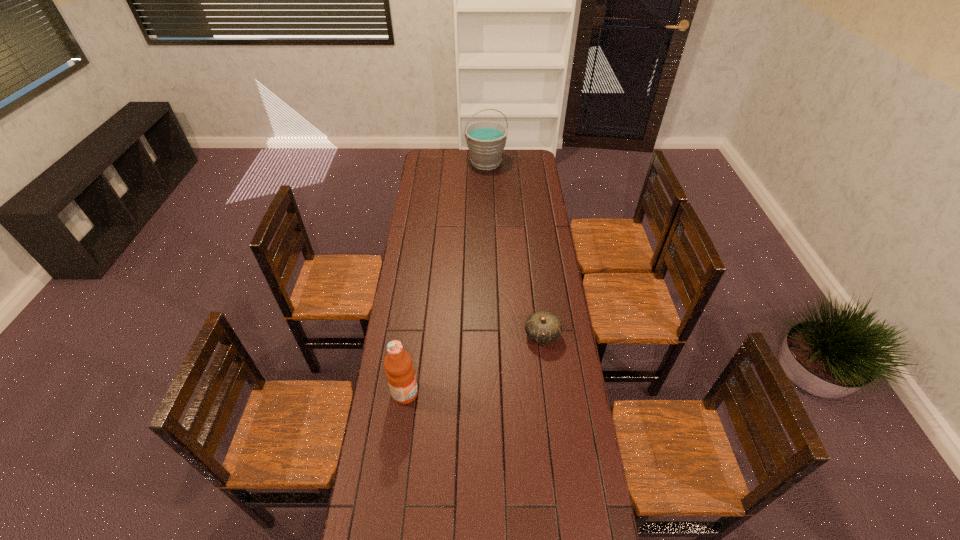
Find the location of `object located at the left edge`. object located at the left edge is located at coordinates (400, 373).

Locate an element on the screen. This screenshot has height=540, width=960. object that is at the right edge is located at coordinates (541, 327).

Find the location of a particular element. vacant area at the left edge is located at coordinates (437, 199).

The height and width of the screenshot is (540, 960). In the image, there is a desktop. In order to click on free space at the right edge in this screenshot , I will do `click(591, 479)`.

Where is `free location at the far right corner`? The height and width of the screenshot is (540, 960). free location at the far right corner is located at coordinates (537, 151).

Locate an element on the screen. The width and height of the screenshot is (960, 540). vacant area that lies between the gourd and the leftmost object is located at coordinates (473, 364).

Where is `free space between the second object from left to right and the gourd`? free space between the second object from left to right and the gourd is located at coordinates (515, 248).

The height and width of the screenshot is (540, 960). I want to click on vacant region between the bucket and the shortest object, so click(515, 248).

The image size is (960, 540). Identify the location of vacant space that is in between the bucket and the nearest object. (445, 278).

Locate an element on the screen. This screenshot has height=540, width=960. free spot between the nearest object and the rightmost object is located at coordinates (x=473, y=364).